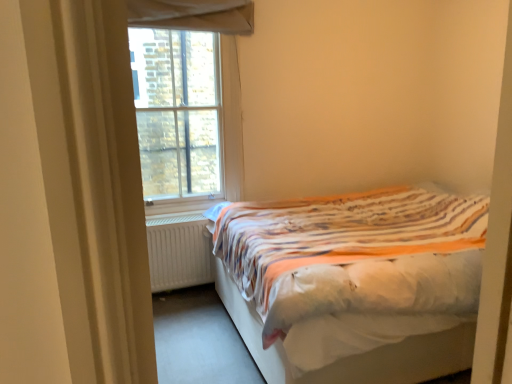
Question: From the image's perspective, is white matte radiator at lower left located beneath clear glass window at upper left?

Choices:
 (A) yes
 (B) no

Answer: (A)

Question: Is white matte radiator at lower left positioned with its back to clear glass window at upper left?

Choices:
 (A) no
 (B) yes

Answer: (A)

Question: Is clear glass window at upper left surrounded by white matte radiator at lower left?

Choices:
 (A) no
 (B) yes

Answer: (A)

Question: Is white matte radiator at lower left positioned beyond the bounds of clear glass window at upper left?

Choices:
 (A) yes
 (B) no

Answer: (A)

Question: Are white matte radiator at lower left and clear glass window at upper left far apart?

Choices:
 (A) yes
 (B) no

Answer: (B)

Question: From a real-world perspective, is white fabric bed at right positioned above or below clear glass window at upper left?

Choices:
 (A) below
 (B) above

Answer: (A)

Question: Is white fabric bed at right to the left or to the right of clear glass window at upper left in the image?

Choices:
 (A) right
 (B) left

Answer: (A)

Question: Which is correct: white fabric bed at right is inside clear glass window at upper left, or outside of it?

Choices:
 (A) inside
 (B) outside

Answer: (B)

Question: In the image, is white fabric bed at right positioned in front of or behind clear glass window at upper left?

Choices:
 (A) behind
 (B) front

Answer: (B)

Question: Considering the positions of white matte radiator at lower left and white fabric bed at right in the image, is white matte radiator at lower left taller or shorter than white fabric bed at right?

Choices:
 (A) short
 (B) tall

Answer: (A)

Question: In the image, is white matte radiator at lower left positioned in front of or behind white fabric bed at right?

Choices:
 (A) behind
 (B) front

Answer: (A)

Question: From a real-world perspective, is white matte radiator at lower left positioned above or below white fabric bed at right?

Choices:
 (A) above
 (B) below

Answer: (B)

Question: Is white matte radiator at lower left wider or thinner than white fabric bed at right?

Choices:
 (A) wide
 (B) thin

Answer: (B)

Question: Is clear glass window at upper left spatially inside white fabric bed at right, or outside of it?

Choices:
 (A) outside
 (B) inside

Answer: (A)

Question: Based on their positions, is clear glass window at upper left located to the left or right of white fabric bed at right?

Choices:
 (A) right
 (B) left

Answer: (B)